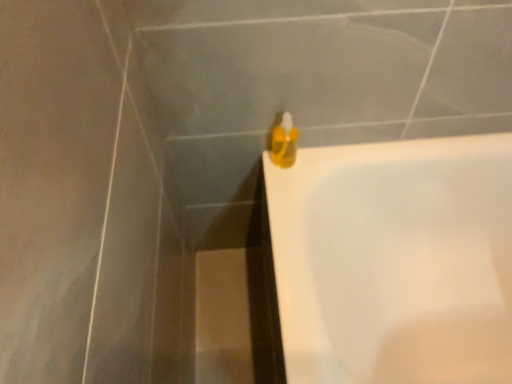
At what (x,y) coordinates should I click in order to perform the action: click on vacant area that is in front of translucent yellow liquid at upper right. Please return your answer as a coordinate pair (x, y). The height and width of the screenshot is (384, 512). Looking at the image, I should click on (284, 201).